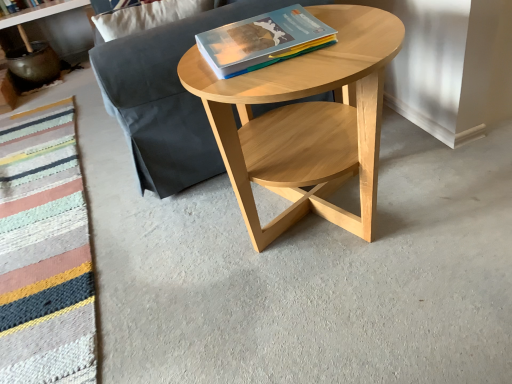
Question: Should I look upward or downward to see matte white shelf at upper left?

Choices:
 (A) down
 (B) up

Answer: (B)

Question: From the image's perspective, is matte white shelf at upper left located above natural wood coffee table at center?

Choices:
 (A) yes
 (B) no

Answer: (A)

Question: From the image's perspective, does matte white shelf at upper left appear lower than natural wood coffee table at center?

Choices:
 (A) no
 (B) yes

Answer: (A)

Question: Does matte white shelf at upper left lie behind natural wood coffee table at center?

Choices:
 (A) no
 (B) yes

Answer: (B)

Question: Does matte white shelf at upper left have a lesser height compared to natural wood coffee table at center?

Choices:
 (A) yes
 (B) no

Answer: (A)

Question: Is the surface of matte white shelf at upper left in direct contact with natural wood coffee table at center?

Choices:
 (A) no
 (B) yes

Answer: (A)

Question: Is natural wood coffee table at center at the back of matte white shelf at upper left?

Choices:
 (A) yes
 (B) no

Answer: (B)

Question: From the image's perspective, is matte paper book at center on natural wood coffee table at center?

Choices:
 (A) yes
 (B) no

Answer: (A)

Question: Is matte paper book at center wider than natural wood coffee table at center?

Choices:
 (A) yes
 (B) no

Answer: (B)

Question: Considering the relative sizes of matte paper book at center and natural wood coffee table at center in the image provided, is matte paper book at center bigger than natural wood coffee table at center?

Choices:
 (A) no
 (B) yes

Answer: (A)

Question: From the image's perspective, is matte paper book at center located beneath natural wood coffee table at center?

Choices:
 (A) yes
 (B) no

Answer: (B)

Question: Can you confirm if matte paper book at center is taller than natural wood coffee table at center?

Choices:
 (A) yes
 (B) no

Answer: (B)

Question: Does matte paper book at center have a smaller size compared to natural wood coffee table at center?

Choices:
 (A) yes
 (B) no

Answer: (A)

Question: Is matte white shelf at upper left aimed at knitted wool blanket at lower left?

Choices:
 (A) no
 (B) yes

Answer: (A)